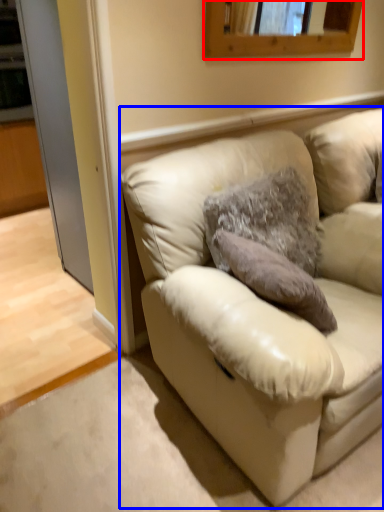
Question: Which of the following is the closest to the observer, mirror (highlighted by a red box) or studio couch (highlighted by a blue box)?

Choices:
 (A) mirror
 (B) studio couch

Answer: (B)